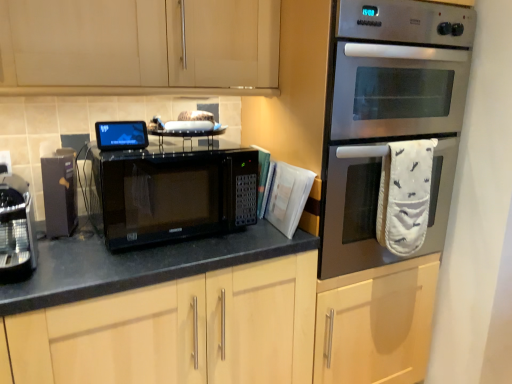
Where is `vacant area in front of matte black coffee machine at left, the second appliance viewed from the left`? The width and height of the screenshot is (512, 384). vacant area in front of matte black coffee machine at left, the second appliance viewed from the left is located at coordinates (62, 247).